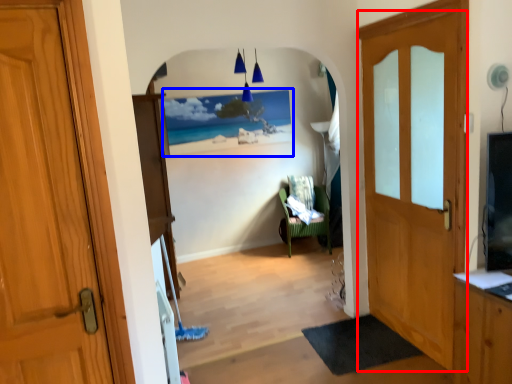
Question: Which object appears closest to the camera in this image, door (highlighted by a red box) or picture frame (highlighted by a blue box)?

Choices:
 (A) door
 (B) picture frame

Answer: (A)